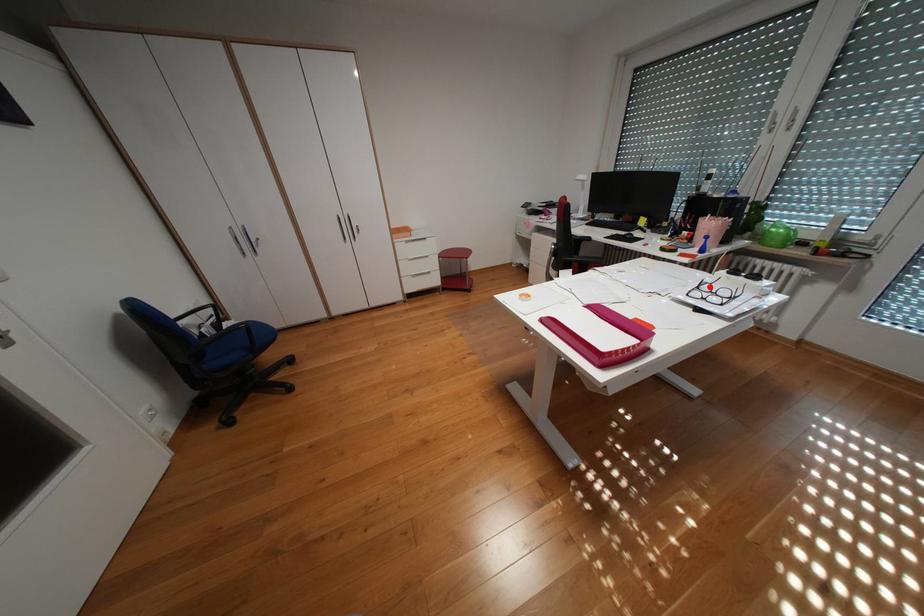
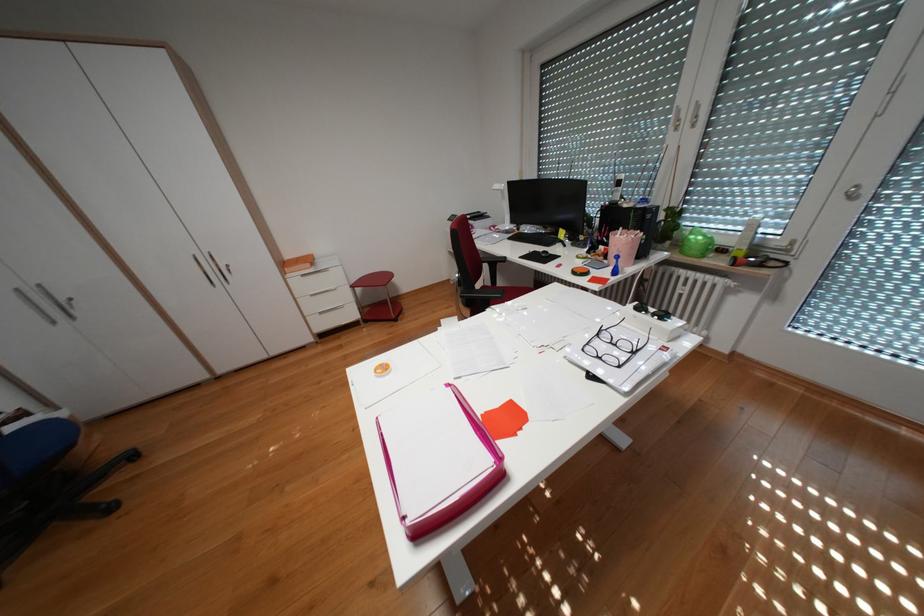
Find the pixel in the second image that matches the highlighted location in the first image.

(610, 334)